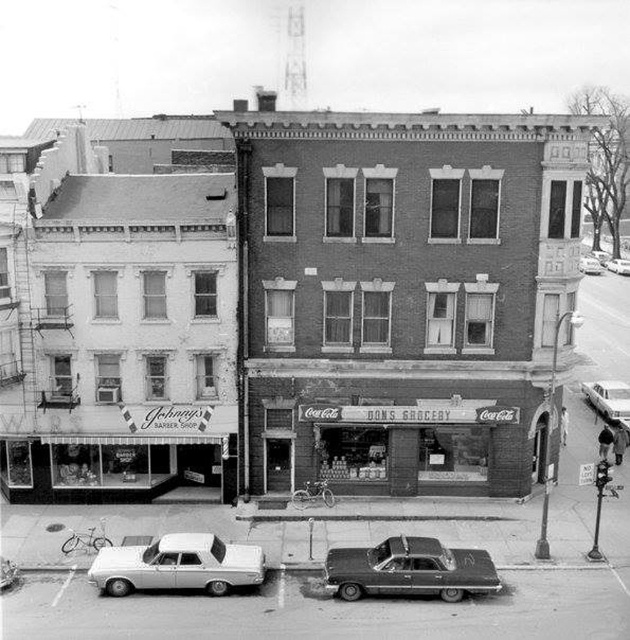
Image resolution: width=630 pixels, height=640 pixels. What do you see at coordinates (178, 564) in the screenshot?
I see `silver metallic sedan at lower center` at bounding box center [178, 564].

Is point (127, 557) more distant than point (610, 268)?

That is False.

Find the location of a particular element. silver metallic sedan at lower center is located at coordinates (178, 564).

Is brick facade store at center to the left of silver metallic sedan at lower center from the viewer's perspective?

In fact, brick facade store at center is to the right of silver metallic sedan at lower center.

Which is below, brick facade store at center or silver metallic sedan at lower center?

Positioned lower is silver metallic sedan at lower center.

Is point (544, 337) farther from camera compared to point (139, 550)?

Yes.

Find the location of a particular element. brick facade store at center is located at coordinates (403, 291).

What do you see at coordinates (410, 570) in the screenshot? The image size is (630, 640). I see `shiny black car at center` at bounding box center [410, 570].

Measure the distance between shiny black car at center and camera.

shiny black car at center is 28.33 meters from camera.

Where is `shiny black car at center`? The image size is (630, 640). shiny black car at center is located at coordinates pyautogui.click(x=410, y=570).